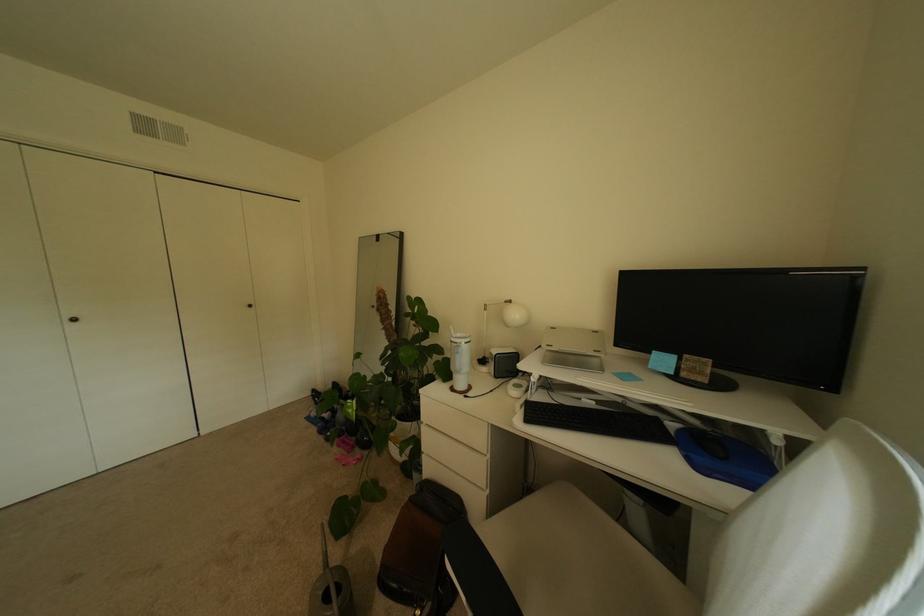
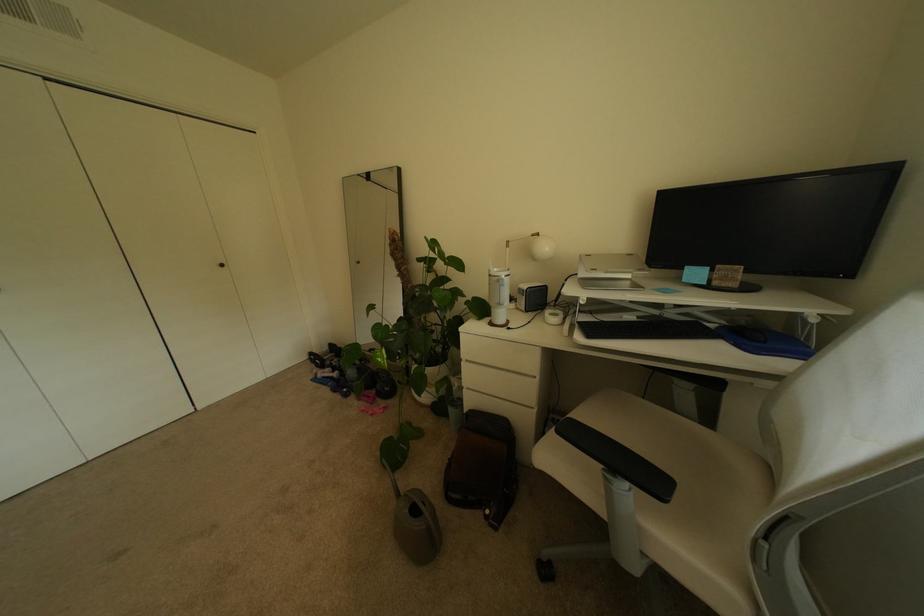
The point at (x=332, y=419) is marked in the first image. Where is the corresponding point in the second image?

(341, 379)